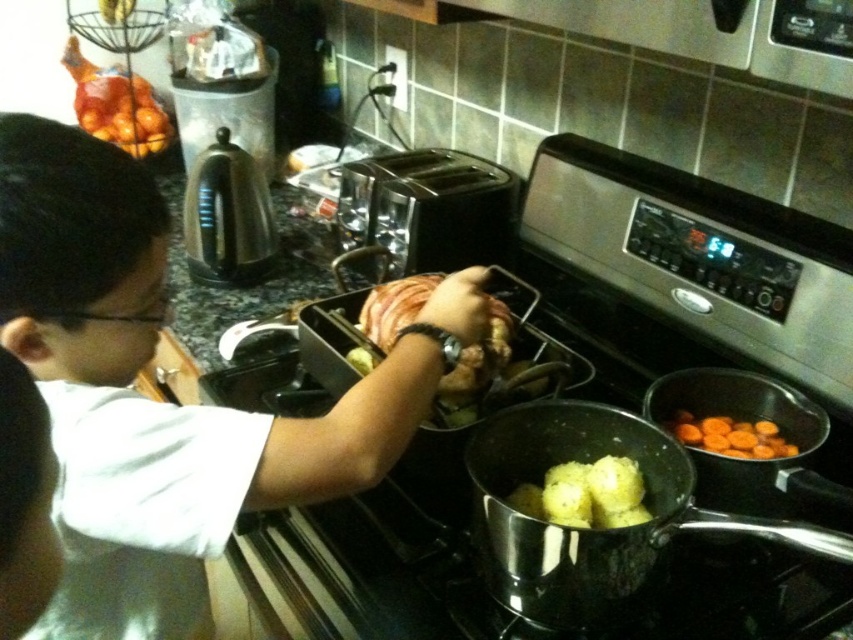
Can you confirm if shiny silver pot at lower center is smaller than shiny metallic kettle at upper left?

No.

Who is more forward, (529, 570) or (216, 168)?

Positioned in front is point (529, 570).

Where is `shiny silver pot at lower center`? The width and height of the screenshot is (853, 640). shiny silver pot at lower center is located at coordinates (x=593, y=529).

Does white matte shirt at upper left appear on the right side of yellow matte potatoes at center?

In fact, white matte shirt at upper left is to the left of yellow matte potatoes at center.

Does point (346, 456) lie behind point (601, 515)?

No, (346, 456) is in front of (601, 515).

The height and width of the screenshot is (640, 853). In order to click on white matte shirt at upper left in this screenshot , I will do `click(163, 403)`.

In the scene shown: Is stainless steel gas stove at center smaller than yellow matte potatoes at center?

Incorrect, stainless steel gas stove at center is not smaller in size than yellow matte potatoes at center.

Can you confirm if stainless steel gas stove at center is positioned below yellow matte potatoes at center?

No, stainless steel gas stove at center is not below yellow matte potatoes at center.

The width and height of the screenshot is (853, 640). What are the coordinates of `stainless steel gas stove at center` in the screenshot? It's located at (479, 579).